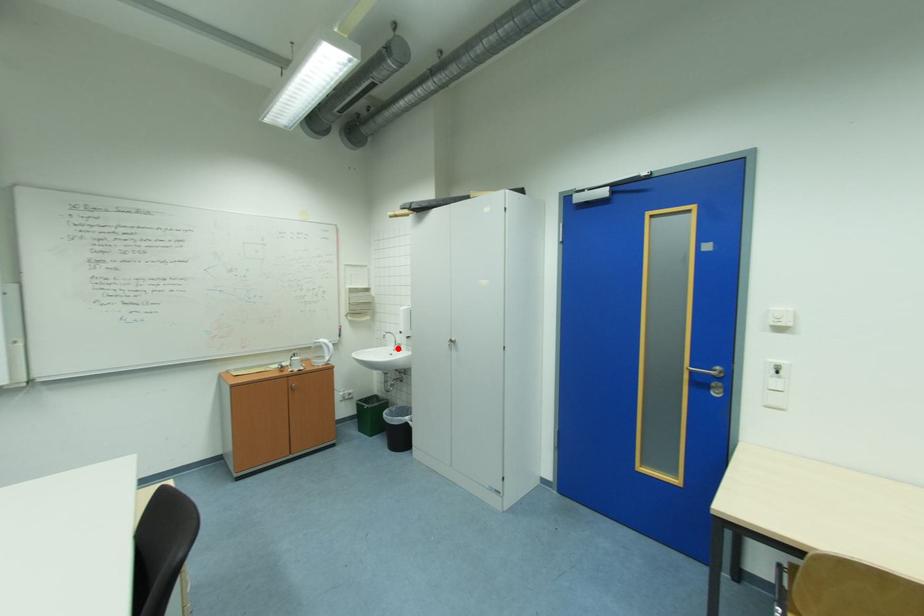
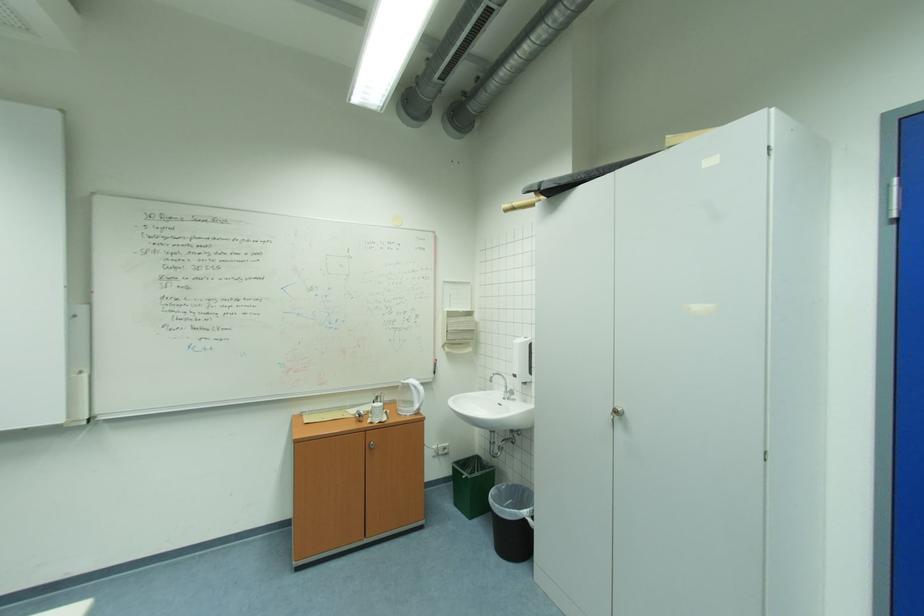
Where in the second image is the point corresponding to the highlighted location from the first image?

(506, 394)